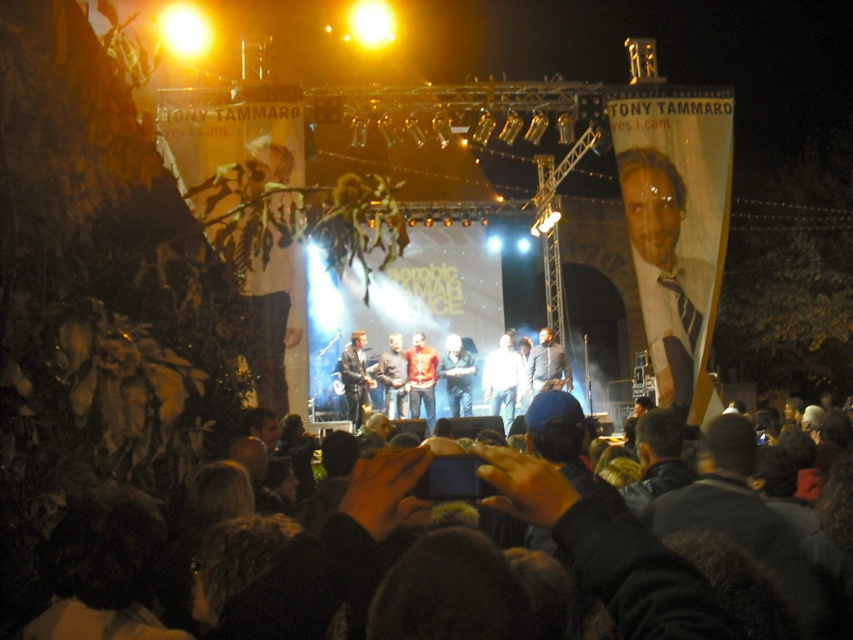
Is blue striped tie at right positioned at the back of white matte shirt at center?

No.

You are a GUI agent. You are given a task and a screenshot of the screen. Output one action in this format:
    pyautogui.click(x=<x>, y=<y>)
    Task: Click on the blue striped tie at right
    The width and height of the screenshot is (853, 640).
    Given the screenshot: What is the action you would take?
    pyautogui.click(x=669, y=276)

Is point (643, 259) closer to viewer compared to point (489, 396)?

Yes.

Find the location of a particular element. The width and height of the screenshot is (853, 640). blue striped tie at right is located at coordinates (669, 276).

Identify the location of denim jacket at center. This screenshot has height=640, width=853. (457, 376).

This screenshot has height=640, width=853. Describe the element at coordinates (503, 378) in the screenshot. I see `white matte shirt at center` at that location.

Is point (490, 388) less distant than point (468, 396)?

No, it is not.

The image size is (853, 640). Identify the location of white matte shirt at center. (503, 378).

Image resolution: width=853 pixels, height=640 pixels. What are the coordinates of `white matte shirt at center` in the screenshot? It's located at (503, 378).